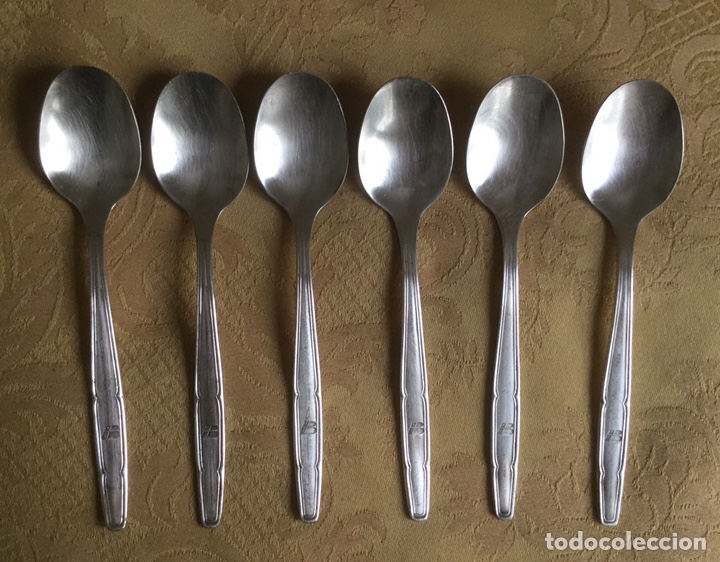
Locate an element on the screen. spoons is located at coordinates (618, 143), (507, 126), (423, 138), (322, 132), (206, 142), (91, 120).